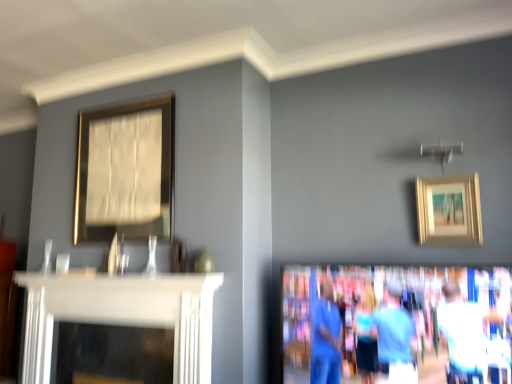
Find the location of `vacant region above gold metallic picture frame at upper left, the first picture frame in the left-to-right sequence (from a real-world perspective)`. vacant region above gold metallic picture frame at upper left, the first picture frame in the left-to-right sequence (from a real-world perspective) is located at coordinates (125, 102).